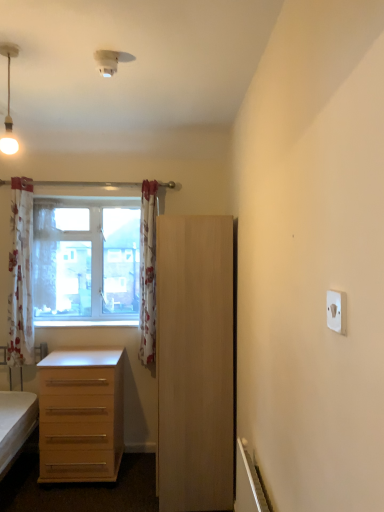
Where is `vacant space situated on the left part of light wood cabinet at center`? vacant space situated on the left part of light wood cabinet at center is located at coordinates (119, 486).